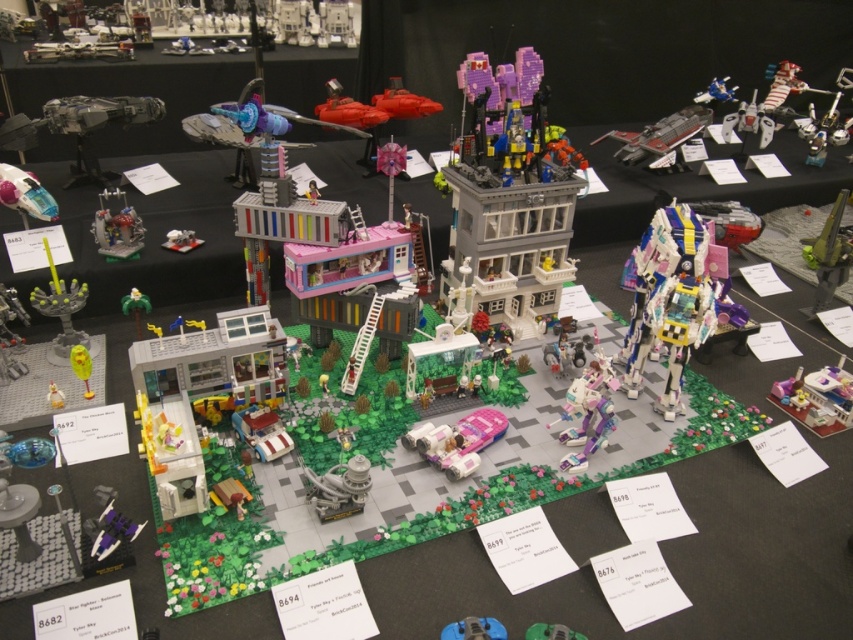
Question: Which point is farther to the camera?

Choices:
 (A) (514, 250)
 (B) (834, 200)
 (C) (144, 298)
 (D) (525, 632)

Answer: (B)

Question: Among these objects, which one is nearest to the camera?

Choices:
 (A) metallic blue spaceship at upper right
 (B) shiny metallic spaceship at upper left
 (C) translucent white plastic robot at center-right
 (D) pastel pink plastic car at lower right

Answer: (C)

Question: Is matte gray spaceship at center below translucent yellow candlestick at lower left?

Choices:
 (A) no
 (B) yes

Answer: (B)

Question: Does green plastic toy at lower center appear under green matte palm tree at lower left?

Choices:
 (A) no
 (B) yes

Answer: (B)

Question: Is metallic silver spaceship at upper right above matte white car at center?

Choices:
 (A) yes
 (B) no

Answer: (A)

Question: Which object appears farthest from the camera in this image?

Choices:
 (A) pink plastic car at center
 (B) shiny metallic spaceship at upper left
 (C) metallic silver spaceship at upper right
 (D) matte gray spaceship at center

Answer: (C)